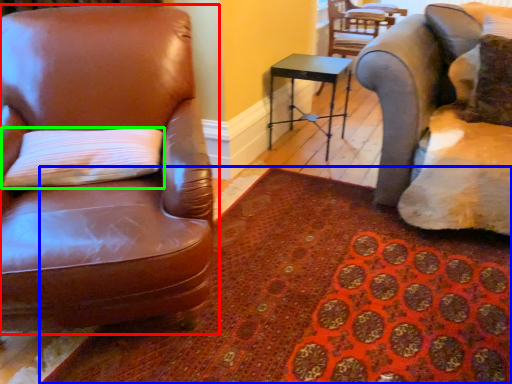
Question: Which object is positioned farthest from chair (highlighted by a red box)? Select from mat (highlighted by a blue box) and pillow (highlighted by a green box).

Choices:
 (A) mat
 (B) pillow

Answer: (A)